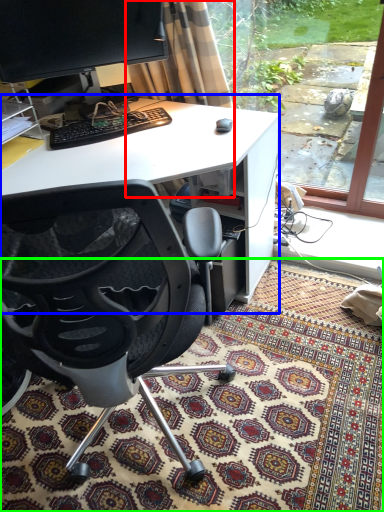
Question: Based on their relative distances, which object is nearer to curtain (highlighted by a red box)? Choose from desk (highlighted by a blue box) and mat (highlighted by a green box).

Choices:
 (A) desk
 (B) mat

Answer: (A)